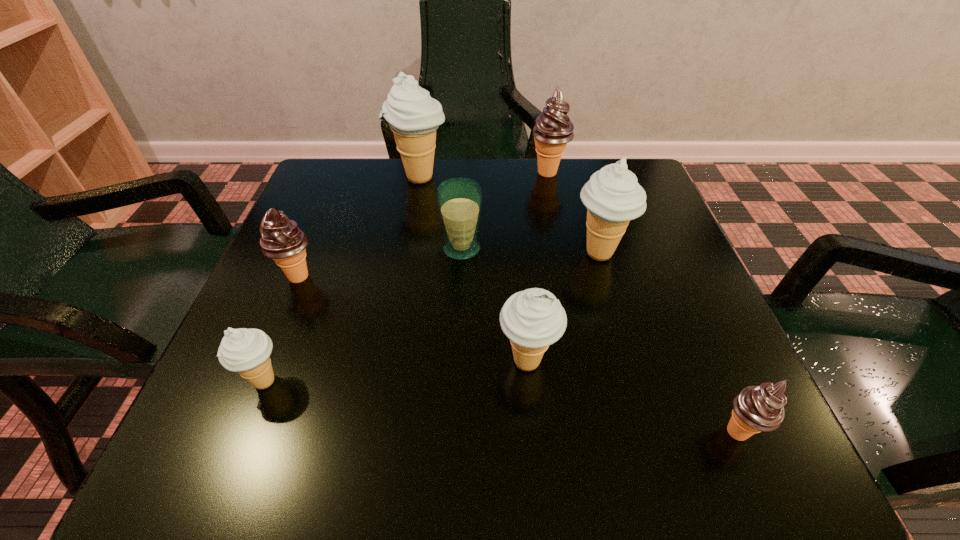
Image resolution: width=960 pixels, height=540 pixels. What are the coordinates of `icecream that is the closest one to the blue glass` in the screenshot? It's located at (413, 116).

Locate which beige icecream is the third closest to the smallest beige icecream. Please provide its 2D coordinates. Your answer should be formatted as a tuple, i.e. [(x, y)], where the tuple contains the x and y coordinates of a point satisfying the conditions above.

[(613, 197)]

Point out which beige icecream is positioned as the second nearest to the rightmost icecream. Please provide its 2D coordinates. Your answer should be formatted as a tuple, i.e. [(x, y)], where the tuple contains the x and y coordinates of a point satisfying the conditions above.

[(613, 197)]

Choose which chocolate icecream is the third nearest neighbor to the third nearest beige icecream. Please provide its 2D coordinates. Your answer should be formatted as a tuple, i.e. [(x, y)], where the tuple contains the x and y coordinates of a point satisfying the conditions above.

[(281, 239)]

Identify the location of chocolate icecream that stands as the second closest to the blue glass. (553, 129).

Find the location of a particular element. vacant space that satisfies the following two spatial constraints: 1. on the front side of the rightmost beige icecream; 2. on the left side of the biggest chocolate icecream is located at coordinates (564, 253).